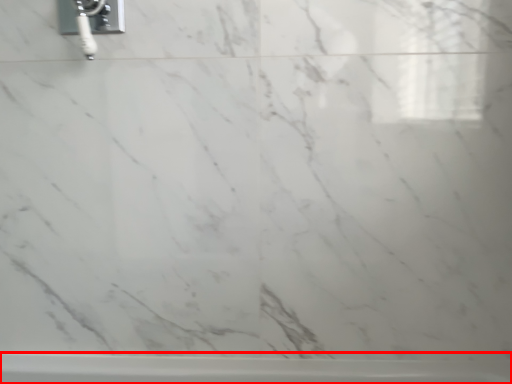
Question: From the image's perspective, what is the correct spatial positioning of bathtub (annotated by the red box) in reference to plumbing fixture?

Choices:
 (A) below
 (B) above

Answer: (A)